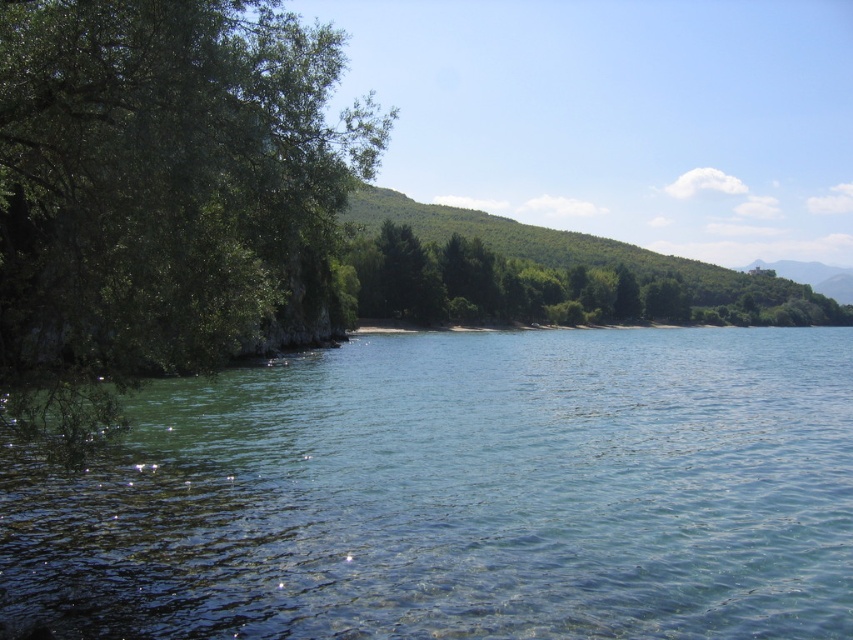
Question: Is green leafy tree at left further to the viewer compared to green leafy trees at center?

Choices:
 (A) no
 (B) yes

Answer: (A)

Question: Which is nearer to the clear water at center?

Choices:
 (A) green leafy trees at center
 (B) green leafy tree at left

Answer: (B)

Question: Among these points, which one is nearest to the camera?

Choices:
 (A) (460, 260)
 (B) (802, 477)

Answer: (B)

Question: Observing the image, what is the correct spatial positioning of green leafy tree at left in reference to green leafy trees at center?

Choices:
 (A) above
 (B) below

Answer: (B)

Question: Which object is farther from the camera taking this photo?

Choices:
 (A) green leafy trees at center
 (B) clear water at center

Answer: (A)

Question: Can you confirm if clear water at center is positioned below green leafy tree at left?

Choices:
 (A) yes
 (B) no

Answer: (A)